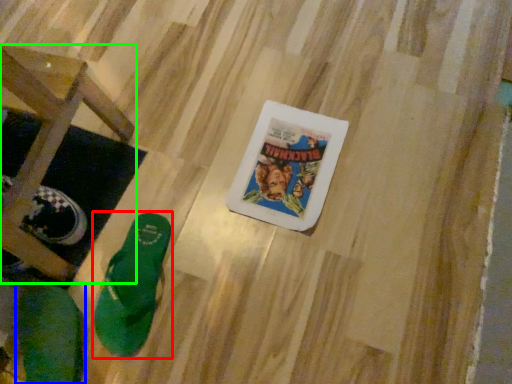
Question: Which is farther away from footwear (highlighted by a red box)? footwear (highlighted by a blue box) or furniture (highlighted by a green box)?

Choices:
 (A) footwear
 (B) furniture

Answer: (B)